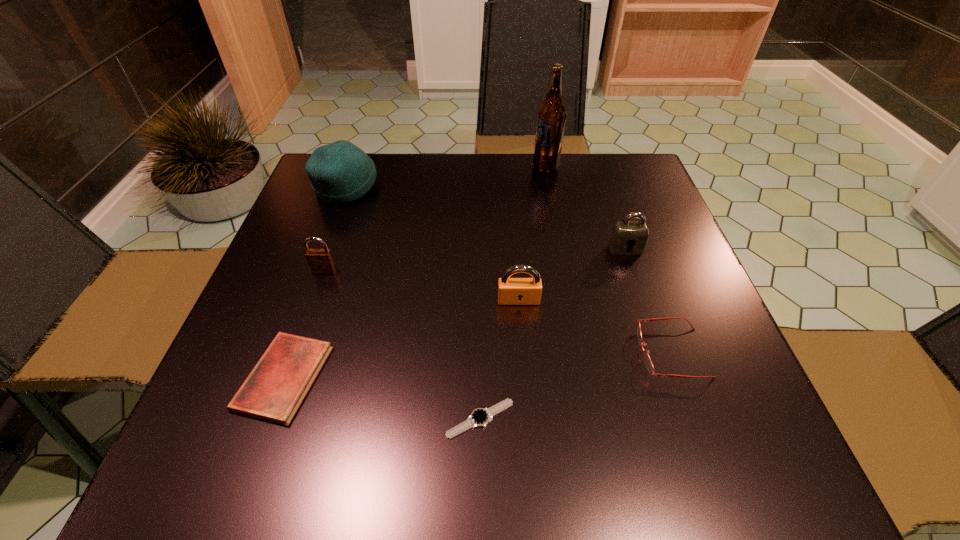
Find the location of `free space between the beanie and the watch`. free space between the beanie and the watch is located at coordinates (413, 303).

Identify the location of empty location between the seventh shortest object and the diary. This screenshot has width=960, height=540. (315, 283).

Identify the location of vacant area that lies between the sixth object from left to right and the spectacles. This screenshot has width=960, height=540. (609, 260).

At what (x,y) coordinates should I click in order to perform the action: click on free space between the second farthest padlock and the seventh tallest object. Please return your answer as a coordinate pair (x, y). The width and height of the screenshot is (960, 540). Looking at the image, I should click on (304, 324).

The height and width of the screenshot is (540, 960). I want to click on vacant area that lies between the sixth object from left to right and the fifth nearest object, so click(435, 219).

Where is `vacant point located between the second tallest object and the farthest padlock`? Image resolution: width=960 pixels, height=540 pixels. vacant point located between the second tallest object and the farthest padlock is located at coordinates (486, 218).

Find the location of a particular element. empty space that is in between the beanie and the leftmost padlock is located at coordinates (335, 230).

Image resolution: width=960 pixels, height=540 pixels. I want to click on free point between the beer bottle and the nearest padlock, so click(x=532, y=233).

You are a GUI agent. You are given a task and a screenshot of the screen. Output one action in this format:
    pyautogui.click(x=<x>, y=<y>)
    Task: Click on the free space between the sixth tallest object and the diary
    The height and width of the screenshot is (540, 960).
    Given the screenshot: What is the action you would take?
    pyautogui.click(x=478, y=365)

Where is `vacant space that's between the second tallest object and the second farthest padlock`? The width and height of the screenshot is (960, 540). vacant space that's between the second tallest object and the second farthest padlock is located at coordinates (335, 230).